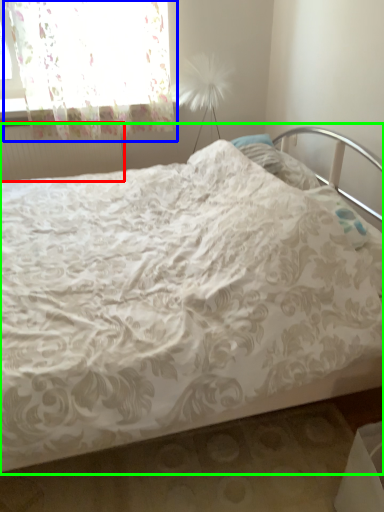
Question: Which object is the closest to the radiator (highlighted by a red box)? Choose among these: curtain (highlighted by a blue box) or bed (highlighted by a green box).

Choices:
 (A) curtain
 (B) bed

Answer: (A)